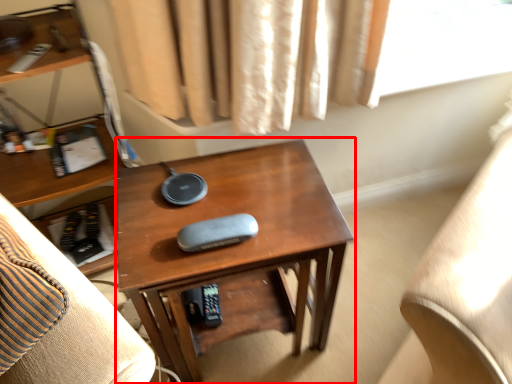
Question: From the image's perspective, where is desk (annotated by the red box) located relative to furniture?

Choices:
 (A) above
 (B) below

Answer: (B)